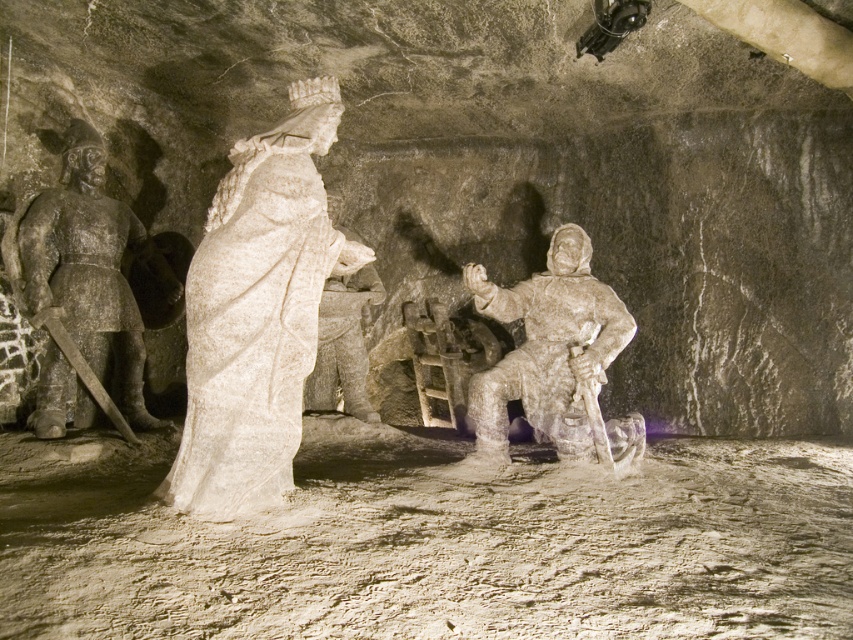
Who is taller, white marble statue at center or white stone statue at center?

white marble statue at center is taller.

Which is above, white marble statue at center or white stone statue at center?

Positioned higher is white stone statue at center.

Identify the location of white marble statue at center. The width and height of the screenshot is (853, 640). (258, 310).

Is white marble statue at center to the right of dark gray stone warrior at left from the viewer's perspective?

Yes, white marble statue at center is to the right of dark gray stone warrior at left.

Who is taller, white marble statue at center or dark gray stone warrior at left?

With more height is dark gray stone warrior at left.

This screenshot has height=640, width=853. I want to click on white marble statue at center, so point(258,310).

What do you see at coordinates (90, 262) in the screenshot? Image resolution: width=853 pixels, height=640 pixels. I see `dark gray stone warrior at left` at bounding box center [90, 262].

Is point (73, 141) farther from viewer compared to point (352, 285)?

No, (73, 141) is in front of (352, 285).

What do you see at coordinates (90, 262) in the screenshot? I see `dark gray stone warrior at left` at bounding box center [90, 262].

At what (x,y) coordinates should I click in order to perform the action: click on dark gray stone warrior at left. Please return your answer as a coordinate pair (x, y). This screenshot has height=640, width=853. Looking at the image, I should click on (90, 262).